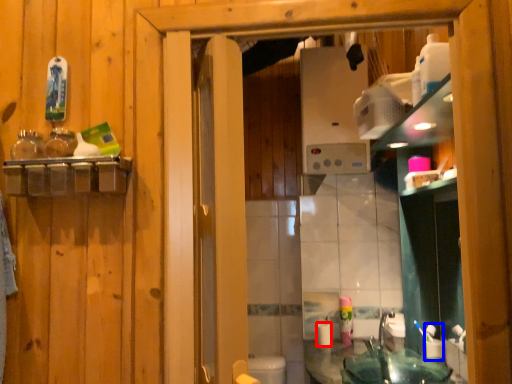
Question: Which of the following is the farthest to the observer, toilet paper (highlighted by a red box) or toiletry (highlighted by a blue box)?

Choices:
 (A) toilet paper
 (B) toiletry

Answer: (A)